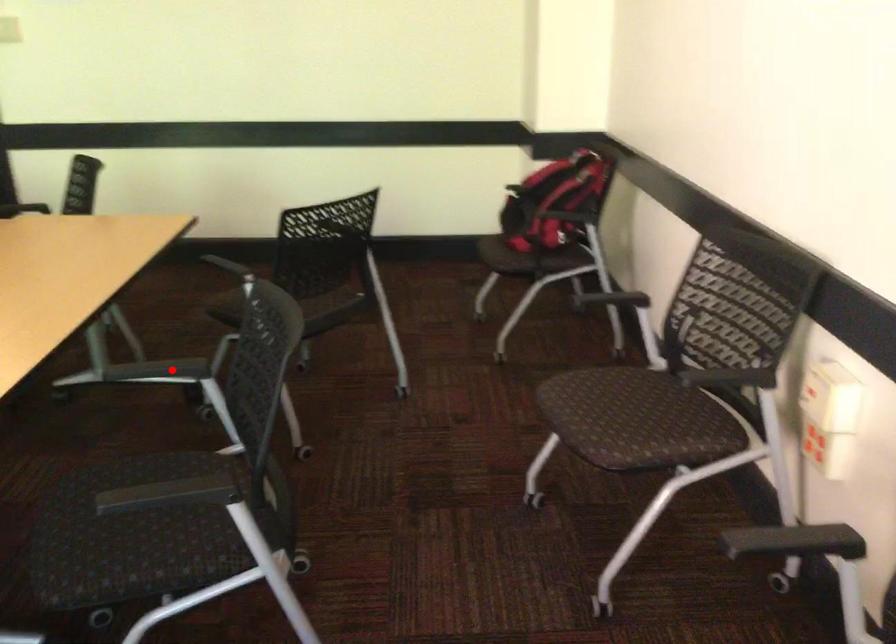
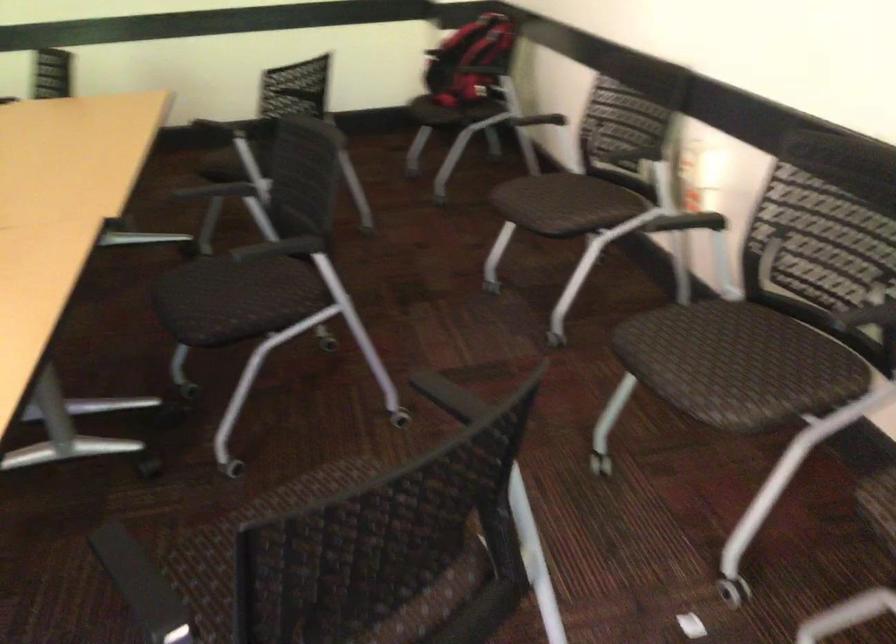
Find the pixel in the second image that matches the highlighted location in the first image.

(216, 189)